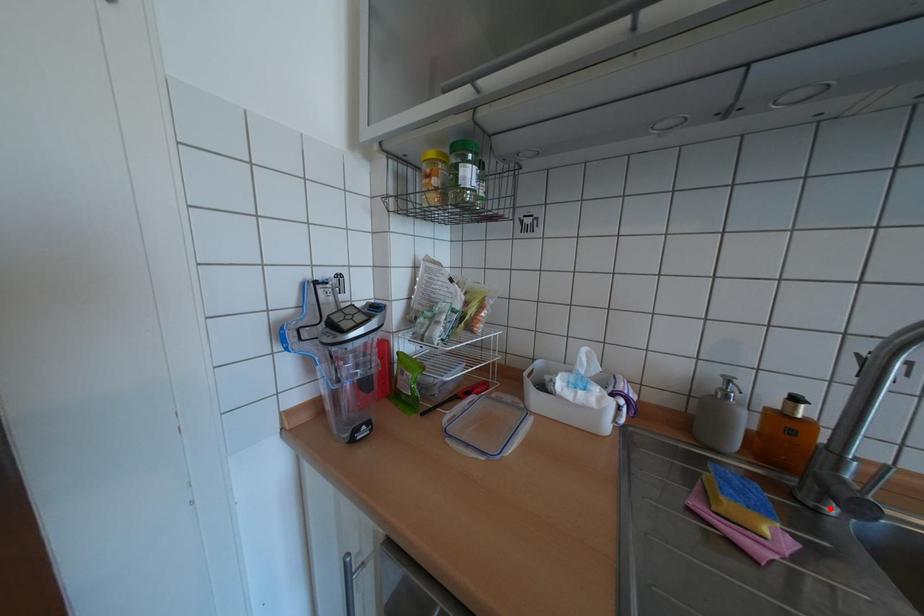
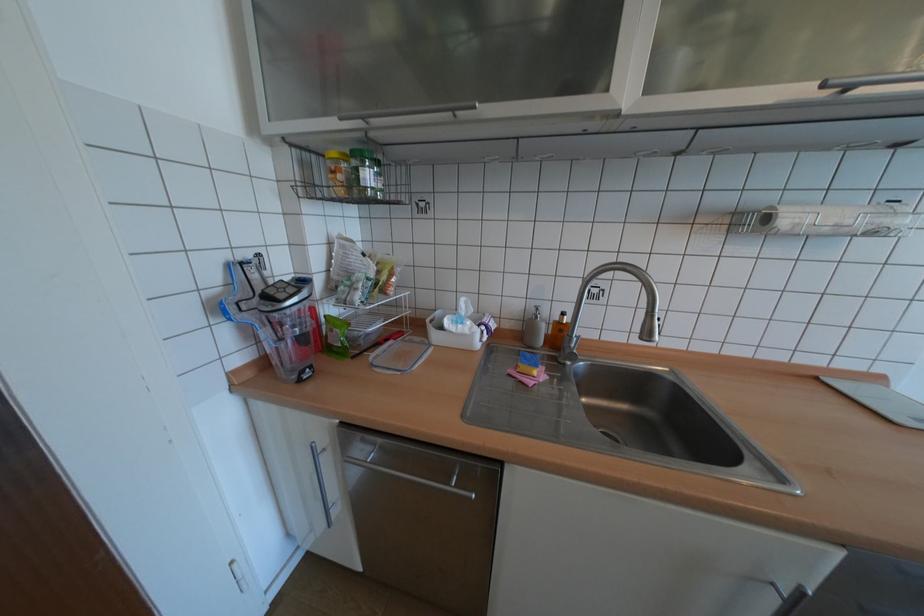
Where in the second image is the point corresponding to the highlighted location from the first image?

(574, 363)